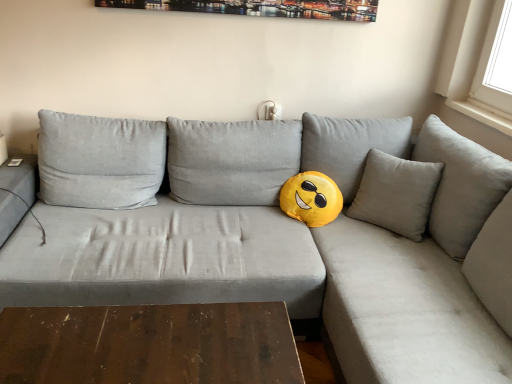
This screenshot has width=512, height=384. Find the location of `light gray fabric couch at center`. light gray fabric couch at center is located at coordinates (306, 243).

What do you see at coordinates (306, 243) in the screenshot?
I see `light gray fabric couch at center` at bounding box center [306, 243].

Where is `light gray fabric couch at center`? light gray fabric couch at center is located at coordinates (306, 243).